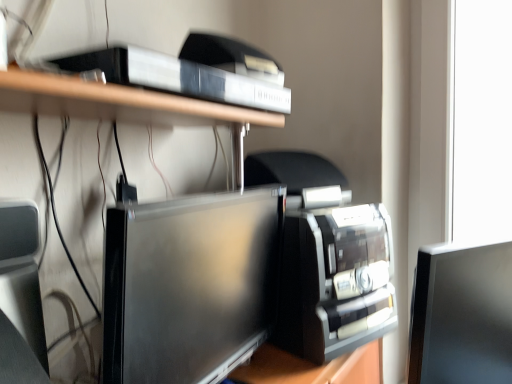
Question: Is white plastic shelf at upper center positioned with its back to satin black monitor at center, which is the 2th computer monitor in right-to-left order?

Choices:
 (A) no
 (B) yes

Answer: (A)

Question: Considering the relative sizes of white plastic shelf at upper center and satin black monitor at center, the 1th computer monitor in the left-to-right sequence, in the image provided, is white plastic shelf at upper center smaller than satin black monitor at center, the 1th computer monitor in the left-to-right sequence,?

Choices:
 (A) yes
 (B) no

Answer: (A)

Question: Can you confirm if white plastic shelf at upper center is bigger than satin black monitor at center, the 1th computer monitor in the left-to-right sequence?

Choices:
 (A) yes
 (B) no

Answer: (B)

Question: Is white plastic shelf at upper center in contact with satin black monitor at center, the 1th computer monitor in the left-to-right sequence?

Choices:
 (A) yes
 (B) no

Answer: (B)

Question: Does white plastic shelf at upper center have a greater width compared to satin black monitor at center, the 1th computer monitor in the left-to-right sequence?

Choices:
 (A) no
 (B) yes

Answer: (A)

Question: From their relative heights in the image, would you say satin black monitor at right, the second computer monitor in the left-to-right sequence, is taller or shorter than white plastic shelf at upper center?

Choices:
 (A) short
 (B) tall

Answer: (B)

Question: Does point (510, 319) appear closer or farther from the camera than point (19, 96)?

Choices:
 (A) closer
 (B) farther

Answer: (B)

Question: Considering the relative positions of satin black monitor at right, which appears as the 1th computer monitor when viewed from the right, and white plastic shelf at upper center in the image provided, is satin black monitor at right, which appears as the 1th computer monitor when viewed from the right, to the left or to the right of white plastic shelf at upper center?

Choices:
 (A) left
 (B) right

Answer: (B)

Question: Is satin black monitor at right, which appears as the 1th computer monitor when viewed from the right, wider or thinner than white plastic shelf at upper center?

Choices:
 (A) wide
 (B) thin

Answer: (B)

Question: Visually, is satin black monitor at right, which appears as the 1th computer monitor when viewed from the right, positioned to the left or to the right of satin black monitor at center, the 1th computer monitor in the left-to-right sequence?

Choices:
 (A) right
 (B) left

Answer: (A)

Question: From a real-world perspective, is satin black monitor at right, the second computer monitor in the left-to-right sequence, physically located above or below satin black monitor at center, the 1th computer monitor in the left-to-right sequence?

Choices:
 (A) above
 (B) below

Answer: (B)

Question: From the image's perspective, is satin black monitor at right, the second computer monitor in the left-to-right sequence, positioned above or below satin black monitor at center, which is the 2th computer monitor in right-to-left order?

Choices:
 (A) above
 (B) below

Answer: (B)

Question: Considering the positions of point (478, 324) and point (112, 375), is point (478, 324) closer or farther from the camera than point (112, 375)?

Choices:
 (A) closer
 (B) farther

Answer: (B)

Question: Is point (224, 340) positioned closer to the camera than point (457, 357)?

Choices:
 (A) farther
 (B) closer

Answer: (B)

Question: Is satin black monitor at center, the 1th computer monitor in the left-to-right sequence, to the left or to the right of satin black monitor at right, the second computer monitor in the left-to-right sequence, in the image?

Choices:
 (A) left
 (B) right

Answer: (A)